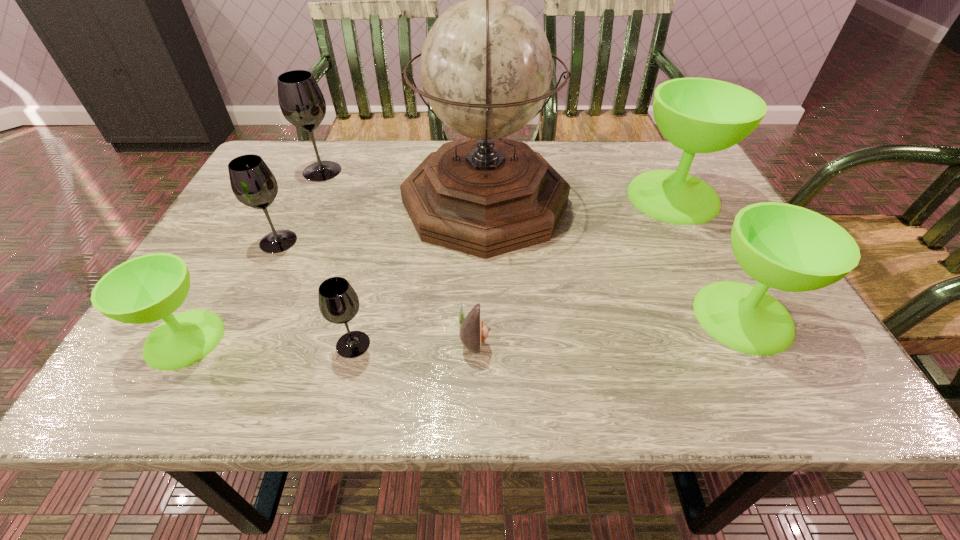
Locate an element on the screen. The width and height of the screenshot is (960, 540). vacant space in between the farthest green wineglass and the globe is located at coordinates (579, 199).

The image size is (960, 540). Find the location of `free space between the farthest green wineglass and the leftmost green wineglass`. free space between the farthest green wineglass and the leftmost green wineglass is located at coordinates (429, 268).

Where is `free area in between the second smallest gray wineglass and the fourth wineglass from left to right`? free area in between the second smallest gray wineglass and the fourth wineglass from left to right is located at coordinates (316, 293).

Find the location of a particular element. This screenshot has width=960, height=540. free space between the fourth nearest wineglass and the farthest gray wineglass is located at coordinates (300, 206).

This screenshot has width=960, height=540. Identify the location of free point between the biggest gray wineglass and the smallest gray wineglass. (338, 258).

At what (x,y) coordinates should I click in order to perform the action: click on free space that is in between the fourth nearest wineglass and the second smallest green wineglass. Please return your answer as a coordinate pair (x, y). Looking at the image, I should click on (511, 279).

Find the location of a particular element. free space between the farthest gray wineglass and the smallest green wineglass is located at coordinates (253, 255).

Where is `empty space between the avocado and the fourth nearest wineglass`? The height and width of the screenshot is (540, 960). empty space between the avocado and the fourth nearest wineglass is located at coordinates (376, 289).

This screenshot has height=540, width=960. In order to click on object that stands as the third closest to the second biggest green wineglass in this screenshot , I will do `click(473, 331)`.

Identify the location of object that is the nearest to the fourth nearest wineglass. (145, 289).